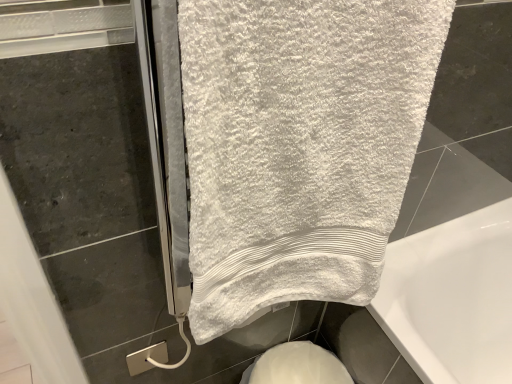
Question: From a real-world perspective, is white soft towel at upper center above or below white glossy bidet at lower center?

Choices:
 (A) above
 (B) below

Answer: (A)

Question: Is white soft towel at upper center in front of or behind white glossy bidet at lower center in the image?

Choices:
 (A) behind
 (B) front

Answer: (B)

Question: Based on their sizes in the image, would you say white soft towel at upper center is bigger or smaller than white glossy bidet at lower center?

Choices:
 (A) small
 (B) big

Answer: (B)

Question: Looking at the image, does white glossy bidet at lower center seem bigger or smaller compared to white soft towel at upper center?

Choices:
 (A) big
 (B) small

Answer: (B)

Question: Looking at their shapes, would you say white glossy bidet at lower center is wider or thinner than white soft towel at upper center?

Choices:
 (A) wide
 (B) thin

Answer: (B)

Question: Do you think white glossy bidet at lower center is within white soft towel at upper center, or outside of it?

Choices:
 (A) outside
 (B) inside

Answer: (A)

Question: Considering the positions of white glossy bidet at lower center and white soft towel at upper center in the image, is white glossy bidet at lower center taller or shorter than white soft towel at upper center?

Choices:
 (A) tall
 (B) short

Answer: (B)